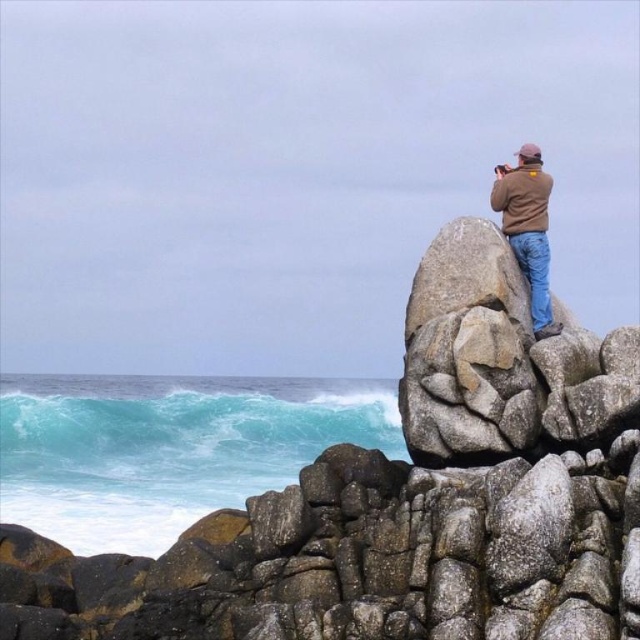
Question: In this image, where is brown suede jacket at upper right located relative to blue denim jeans at upper right?

Choices:
 (A) below
 (B) above

Answer: (B)

Question: Among these objects, which one is farthest from the camera?

Choices:
 (A) brown suede jacket at upper right
 (B) granite boulder at upper right

Answer: (A)

Question: Among these objects, which one is farthest from the camera?

Choices:
 (A) brown suede jacket at upper right
 (B) blue denim jeans at upper right

Answer: (A)

Question: Which of these objects is positioned closest to the granite boulder at upper right?

Choices:
 (A) brown suede jacket at upper right
 (B) blue denim jeans at upper right

Answer: (B)

Question: Can you confirm if granite boulder at upper right is positioned below blue denim jeans at upper right?

Choices:
 (A) no
 (B) yes

Answer: (B)

Question: Does granite boulder at upper right have a smaller size compared to blue denim jeans at upper right?

Choices:
 (A) yes
 (B) no

Answer: (B)